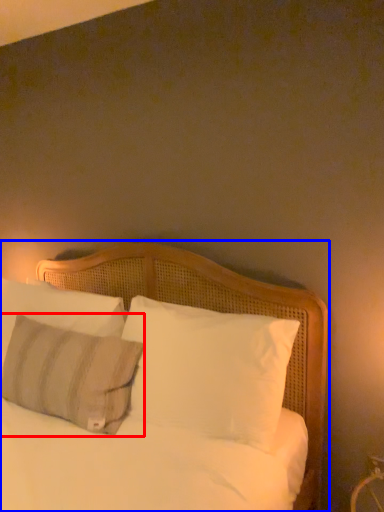
Question: Which of the following is the closest to the observer, pillow (highlighted by a red box) or bed (highlighted by a blue box)?

Choices:
 (A) pillow
 (B) bed

Answer: (B)